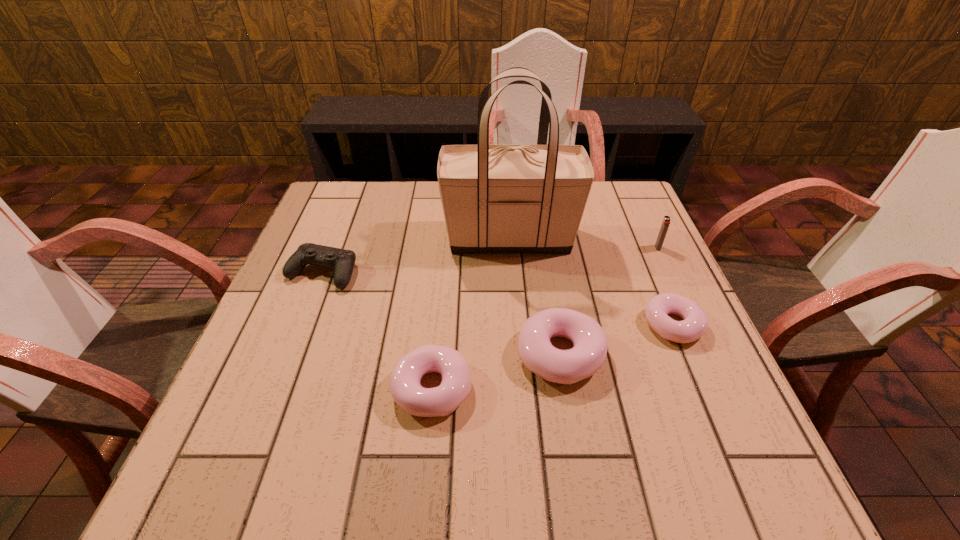
In the image, there is a desktop. Where is `free region at the near edge`? This screenshot has width=960, height=540. free region at the near edge is located at coordinates (384, 425).

Locate an element on the screen. This screenshot has height=540, width=960. free location at the left edge of the desktop is located at coordinates (251, 369).

In the image, there is a desktop. Where is `vacant space at the right edge`? The width and height of the screenshot is (960, 540). vacant space at the right edge is located at coordinates (609, 269).

The width and height of the screenshot is (960, 540). I want to click on blank space at the far left corner, so click(361, 207).

The image size is (960, 540). Find the location of `free space at the near left corner`. free space at the near left corner is located at coordinates (237, 390).

The width and height of the screenshot is (960, 540). In the image, there is a desktop. In order to click on free space at the far right corner in this screenshot , I will do `click(621, 218)`.

Where is `free space between the leftmost object and the shortest doughnut`? This screenshot has height=540, width=960. free space between the leftmost object and the shortest doughnut is located at coordinates (497, 299).

Find the location of a particular element. This screenshot has height=540, width=960. free space between the shortest object and the igniter is located at coordinates (665, 287).

This screenshot has width=960, height=540. I want to click on free space that is in between the second doughnut from left to right and the leftmost doughnut, so click(496, 371).

Locate an element on the screen. The image size is (960, 540). free space that is in between the igniter and the second doughnut from right to left is located at coordinates (609, 301).